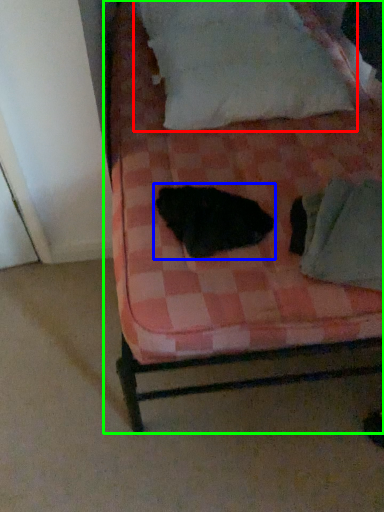
Question: Considering the real-world distances, which object is closest to pillow (highlighted by a red box)? animal (highlighted by a blue box) or bed (highlighted by a green box).

Choices:
 (A) animal
 (B) bed

Answer: (B)